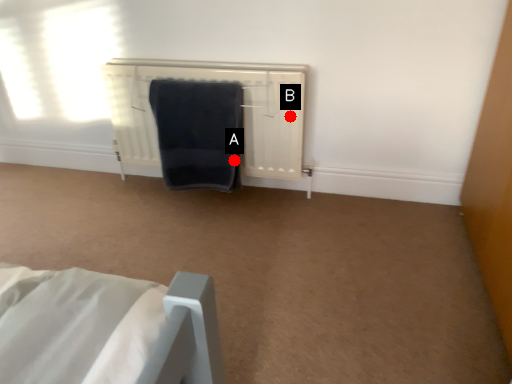
Question: Two points are circled on the image, labeled by A and B beside each circle. Which point is closer to the camera?

Choices:
 (A) A is closer
 (B) B is closer

Answer: (B)